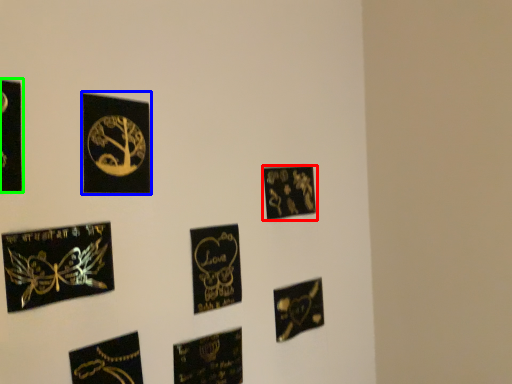
Question: Which is farther away from picture frame (highlighted by a red box)? picture frame (highlighted by a blue box) or picture frame (highlighted by a green box)?

Choices:
 (A) picture frame
 (B) picture frame

Answer: (B)